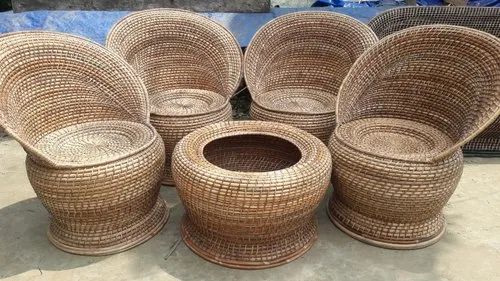
Where is `left chair seat`? left chair seat is located at coordinates (84, 144).